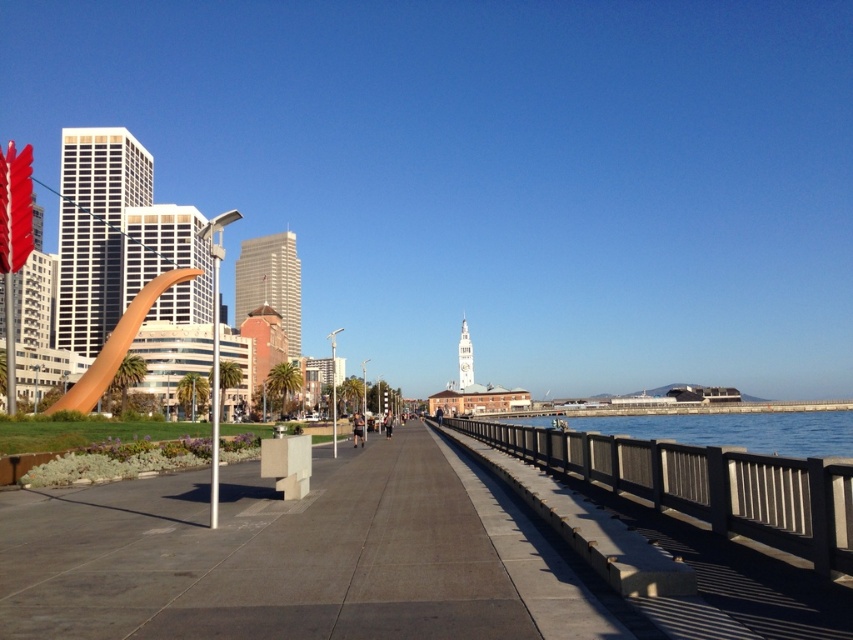
You are a city planner assessing the waterfront area. You need to determine which area takes up more space between the brown wooden rail at right and the clear blue water at right. Based on the scene, which one occupies more space?

The clear blue water at right occupies more space than the brown wooden rail at right according to the description.

You are a delivery drone flying over the waterfront scene. You need to land on the clear blue water at right, but you must avoid hitting the brown wooden rail at right. Can you safely land there without collision?

The brown wooden rail at right has a lesser height compared to clear blue water at right, so the drone can safely land on the clear blue water at right without hitting the rail since the rail is shorter in height.

You are standing at the center of the walkway in the urban waterfront scene. You want to reach the brown wooden rail at right. Which direction should you move to get there?

You should move to your right to reach the brown wooden rail at right because it is located at the right side of the walkway.